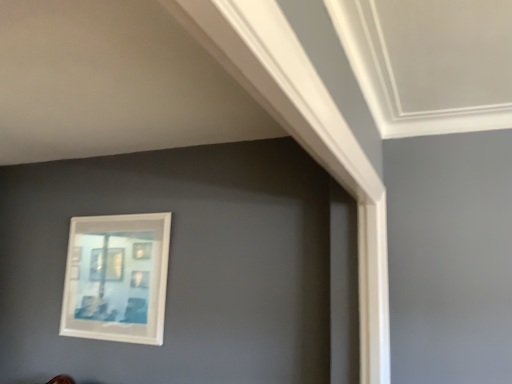
Locate an element on the screen. This screenshot has width=512, height=384. white matte picture frame at upper left is located at coordinates (117, 278).

Describe the element at coordinates (117, 278) in the screenshot. I see `white matte picture frame at upper left` at that location.

What are the coordinates of `white matte picture frame at upper left` in the screenshot? It's located at (117, 278).